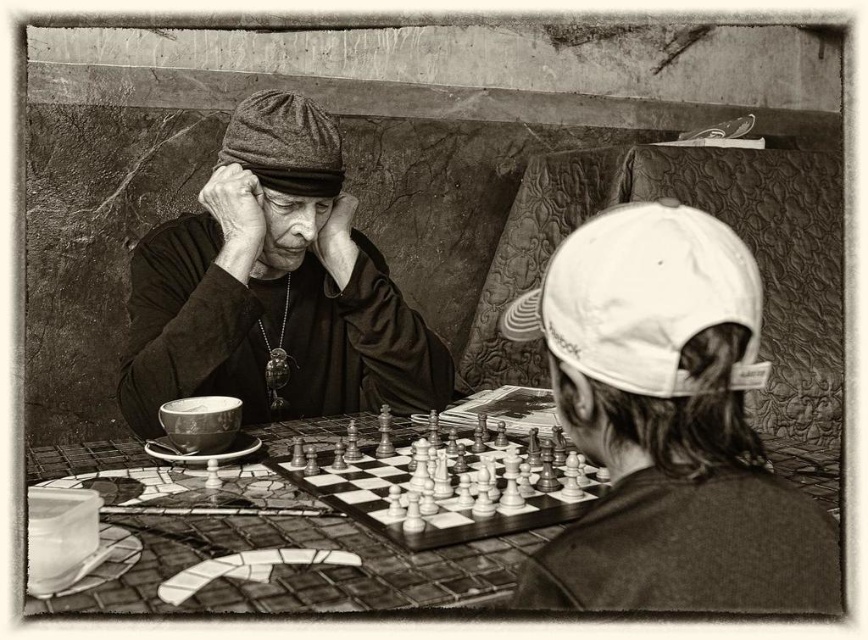
Between dark woolen cap at upper left and wooden chessboard at center, which one appears on the left side from the viewer's perspective?

dark woolen cap at upper left is more to the left.

Can you confirm if dark woolen cap at upper left is thinner than wooden chessboard at center?

In fact, dark woolen cap at upper left might be wider than wooden chessboard at center.

Is point (344, 294) more distant than point (511, 474)?

Yes, it is behind point (511, 474).

Where is `dark woolen cap at upper left`? dark woolen cap at upper left is located at coordinates (273, 289).

Which is below, mosaic tile table at center or white fabric baseball cap at upper right?

mosaic tile table at center

Can you confirm if mosaic tile table at center is thinner than white fabric baseball cap at upper right?

Incorrect, mosaic tile table at center's width is not less than white fabric baseball cap at upper right's.

What do you see at coordinates (308, 561) in the screenshot? This screenshot has width=868, height=640. I see `mosaic tile table at center` at bounding box center [308, 561].

The height and width of the screenshot is (640, 868). Identify the location of mosaic tile table at center. click(308, 561).

How much distance is there between dark woolen cap at upper left and gray woolen baseball cap at upper center?

dark woolen cap at upper left and gray woolen baseball cap at upper center are 5.74 inches apart from each other.

Is dark woolen cap at upper left closer to camera compared to gray woolen baseball cap at upper center?

Yes, dark woolen cap at upper left is in front of gray woolen baseball cap at upper center.

Where is `dark woolen cap at upper left`? The width and height of the screenshot is (868, 640). dark woolen cap at upper left is located at coordinates (273, 289).

The image size is (868, 640). In order to click on dark woolen cap at upper left in this screenshot , I will do `click(273, 289)`.